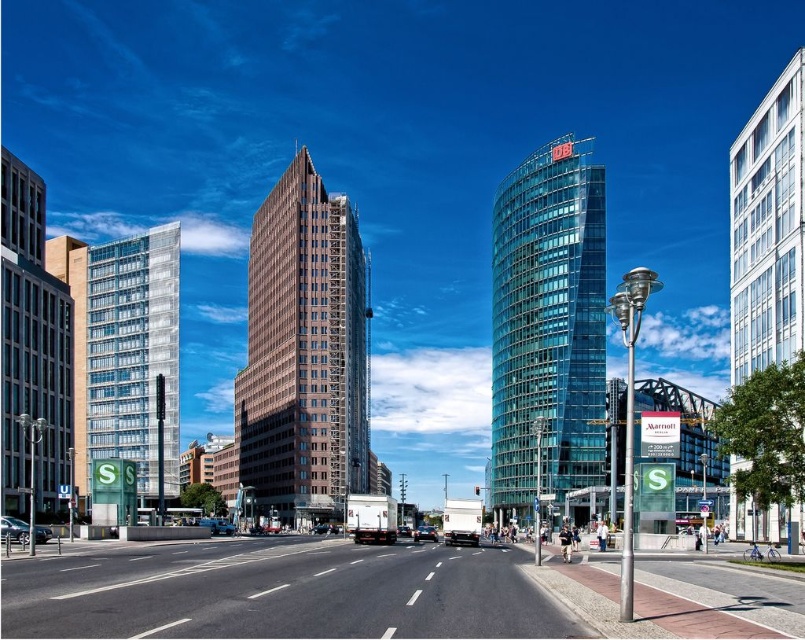
You are standing on the sidewalk observing the transparent glass tower at center and the white glass building at right. Which building is closer to you?

The transparent glass tower at center is closer to you because it is positioned further to the viewer than the white glass building at right.

You are a drone operator who needs to fly a drone from the clear glass building at left to the other building. The drone has a maximum range of 100 meters. Can it reach the other building?

The clear glass building at left and the other building are 106.12 meters apart, which exceeds the drone operator s drone maximum range of 100 meters. The drone cannot reach the other building.